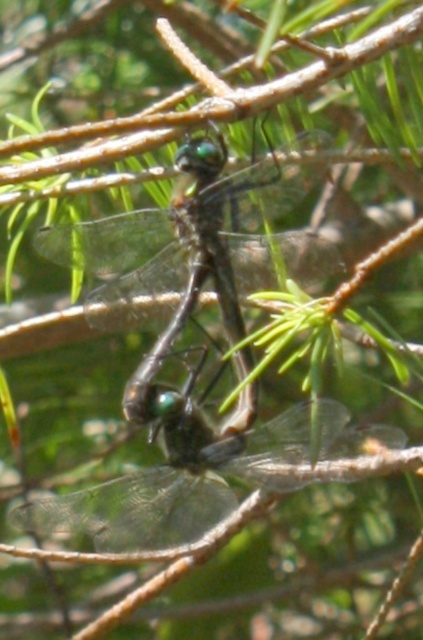
Can you confirm if transparent winged dragonfly at center is wider than transparent glass dragonfly at center?

Correct, the width of transparent winged dragonfly at center exceeds that of transparent glass dragonfly at center.

Is the position of transparent winged dragonfly at center more distant than that of transparent glass dragonfly at center?

No, it is not.

Describe the element at coordinates (208, 474) in the screenshot. I see `transparent winged dragonfly at center` at that location.

Identify the location of transparent winged dragonfly at center. (208, 474).